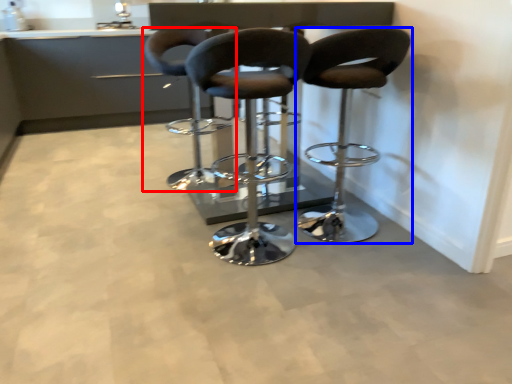
Question: Which point is closer to the camera, chair (highlighted by a red box) or chair (highlighted by a blue box)?

Choices:
 (A) chair
 (B) chair

Answer: (B)